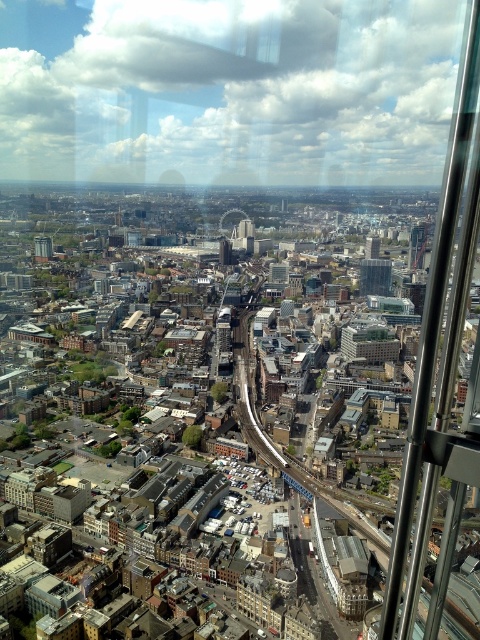
You are standing at the glass railing in the foreground of the cityscape image. There is a glassy reflective skyscraper at center. Can you confirm if the glassy reflective skyscraper at center is exactly at the point marked as (374, 276)?

Yes, the glassy reflective skyscraper at center is located at point (374, 276).

You are an architect designing a new city park between the glassy reflective skyscraper at center and the matte gray tower at center. Which building should you consider for a wider base to accommodate more green space?

The glassy reflective skyscraper at center is wider than the matte gray tower at center, so it would be better to consider its wider base for more green space.

You are standing at the glass railing in the foreground of the cityscape image. You notice a point marked at coordinates (43, 248). What object is located at this point?

The point at (43, 248) marks the matte gray tower at center.